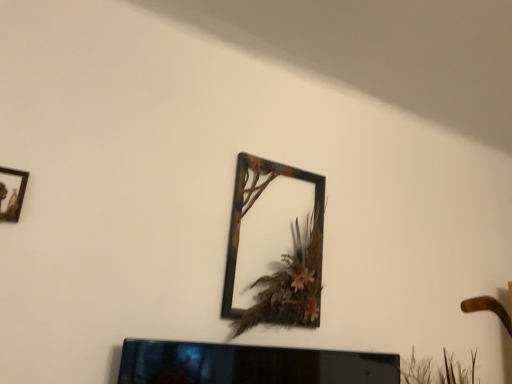
Question: Is metallic frame at upper center, the first picture frame viewed from the right, at the back of wooden frame at upper left, the 1th picture frame from the left?

Choices:
 (A) yes
 (B) no

Answer: (B)

Question: Is wooden frame at upper left, which is the first picture frame from front to back, positioned beyond the bounds of metallic frame at upper center, the 2th picture frame in the left-to-right sequence?

Choices:
 (A) yes
 (B) no

Answer: (A)

Question: Is wooden frame at upper left, which is the first picture frame from front to back, thinner than metallic frame at upper center, the 1th picture frame in the back-to-front sequence?

Choices:
 (A) no
 (B) yes

Answer: (B)

Question: From a real-world perspective, is wooden frame at upper left, arranged as the second picture frame when viewed from the back, below metallic frame at upper center, which is the second picture frame in front-to-back order?

Choices:
 (A) yes
 (B) no

Answer: (A)

Question: Is metallic frame at upper center, the first picture frame viewed from the right, surrounded by wooden frame at upper left, positioned as the 2th picture frame in right-to-left order?

Choices:
 (A) no
 (B) yes

Answer: (A)

Question: From the image's perspective, relative to black glossy tv at lower center, is metallic frame at upper center, the 2th picture frame in the left-to-right sequence, above or below?

Choices:
 (A) below
 (B) above

Answer: (B)

Question: Looking at their shapes, would you say metallic frame at upper center, the first picture frame viewed from the right, is wider or thinner than black glossy tv at lower center?

Choices:
 (A) wide
 (B) thin

Answer: (A)

Question: From a real-world perspective, is metallic frame at upper center, which is the second picture frame in front-to-back order, positioned above or below black glossy tv at lower center?

Choices:
 (A) above
 (B) below

Answer: (A)

Question: Looking at the image, does metallic frame at upper center, the first picture frame viewed from the right, seem bigger or smaller compared to black glossy tv at lower center?

Choices:
 (A) big
 (B) small

Answer: (A)

Question: Looking at the image, does wooden frame at upper left, positioned as the 2th picture frame in right-to-left order, seem bigger or smaller compared to metallic frame at upper center, the 1th picture frame in the back-to-front sequence?

Choices:
 (A) small
 (B) big

Answer: (A)

Question: From a real-world perspective, is wooden frame at upper left, the 1th picture frame from the left, physically located above or below metallic frame at upper center, which is the second picture frame in front-to-back order?

Choices:
 (A) above
 (B) below

Answer: (B)

Question: Looking at their shapes, would you say wooden frame at upper left, arranged as the second picture frame when viewed from the back, is wider or thinner than metallic frame at upper center, the first picture frame viewed from the right?

Choices:
 (A) thin
 (B) wide

Answer: (A)

Question: Is wooden frame at upper left, arranged as the second picture frame when viewed from the back, taller or shorter than metallic frame at upper center, the first picture frame viewed from the right?

Choices:
 (A) tall
 (B) short

Answer: (B)

Question: Relative to metallic frame at upper center, the first picture frame viewed from the right, is black glossy tv at lower center in front or behind?

Choices:
 (A) behind
 (B) front

Answer: (B)

Question: From the image's perspective, is black glossy tv at lower center located above or below metallic frame at upper center, the first picture frame viewed from the right?

Choices:
 (A) below
 (B) above

Answer: (A)